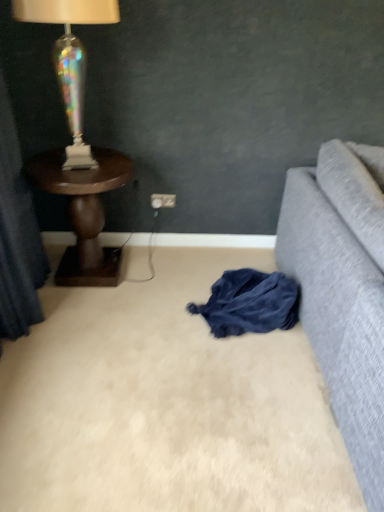
Question: From the image's perspective, does dark blue fabric at lower center appear lower than dark wood side table at left?

Choices:
 (A) no
 (B) yes

Answer: (B)

Question: Can dark wood side table at left be found inside dark blue fabric at lower center?

Choices:
 (A) no
 (B) yes

Answer: (A)

Question: Is dark blue fabric at lower center smaller than dark wood side table at left?

Choices:
 (A) yes
 (B) no

Answer: (A)

Question: Is dark blue fabric at lower center taller than dark wood side table at left?

Choices:
 (A) no
 (B) yes

Answer: (A)

Question: Is dark blue fabric at lower center facing away from dark wood side table at left?

Choices:
 (A) no
 (B) yes

Answer: (A)

Question: Can you confirm if dark blue fabric at lower center is shorter than dark wood side table at left?

Choices:
 (A) yes
 (B) no

Answer: (A)

Question: Does white plastic power outlet at center have a lesser width compared to dark wood side table at left?

Choices:
 (A) yes
 (B) no

Answer: (A)

Question: From the image's perspective, does white plastic power outlet at center appear lower than dark wood side table at left?

Choices:
 (A) yes
 (B) no

Answer: (B)

Question: Can you confirm if white plastic power outlet at center is taller than dark wood side table at left?

Choices:
 (A) no
 (B) yes

Answer: (A)

Question: Is white plastic power outlet at center facing towards dark wood side table at left?

Choices:
 (A) yes
 (B) no

Answer: (B)

Question: From a real-world perspective, is white plastic power outlet at center below dark wood side table at left?

Choices:
 (A) no
 (B) yes

Answer: (B)

Question: Can you confirm if white plastic power outlet at center is wider than dark wood side table at left?

Choices:
 (A) no
 (B) yes

Answer: (A)

Question: From a real-world perspective, is dark wood side table at left physically below white plastic power outlet at center?

Choices:
 (A) yes
 (B) no

Answer: (B)